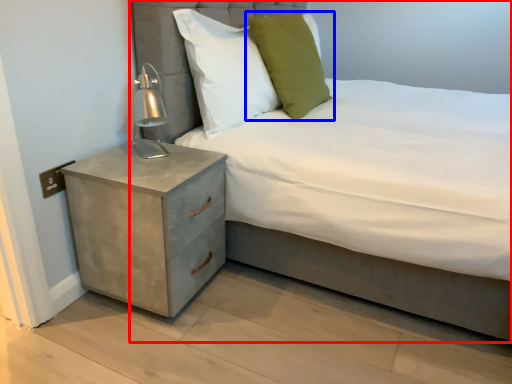
Question: Which point is closer to the camera, bed (highlighted by a red box) or pillow (highlighted by a blue box)?

Choices:
 (A) bed
 (B) pillow

Answer: (A)